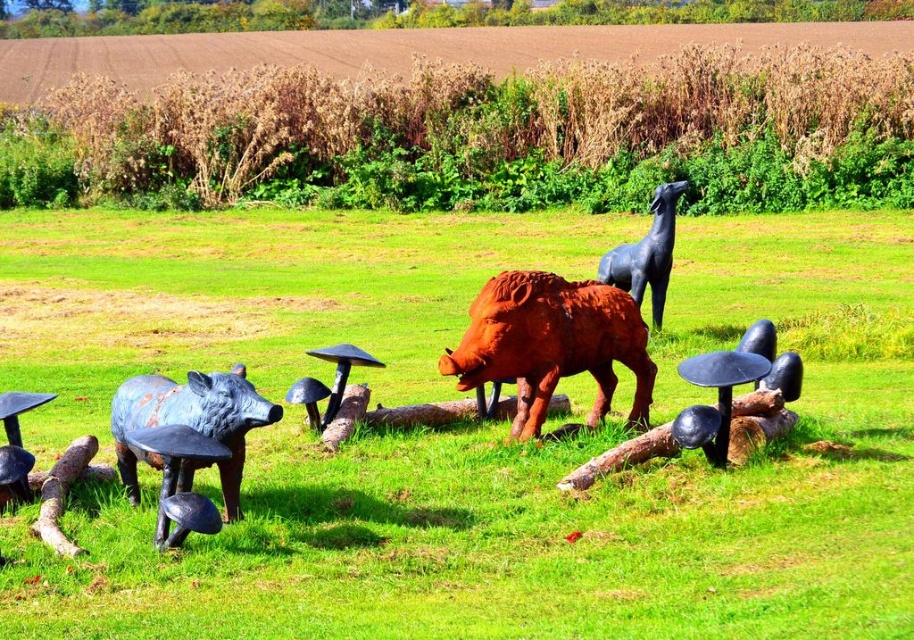
Who is taller, brown wood log at center or brushed metal boar at lower left?

brushed metal boar at lower left

In the scene shown: Is brown wood log at center shorter than brushed metal boar at lower left?

Correct, brown wood log at center is not as tall as brushed metal boar at lower left.

Is point (422, 410) farther from viewer compared to point (28, 456)?

Yes, it is.

At what (x,y) coordinates should I click in order to perform the action: click on brown wood log at center. Please return your answer as a coordinate pair (x, y). The image size is (914, 640). Looking at the image, I should click on (422, 413).

Can you confirm if rusty wood log at lower left is wider than brushed metal boar at lower left?

Correct, the width of rusty wood log at lower left exceeds that of brushed metal boar at lower left.

Can you confirm if rusty wood log at lower left is positioned below brushed metal boar at lower left?

Indeed, rusty wood log at lower left is positioned under brushed metal boar at lower left.

Between point (58, 532) and point (5, 397), which one is positioned in front?

Point (58, 532) is more forward.

In order to click on rusty wood log at lower left in this screenshot , I will do `click(62, 493)`.

Is rustic wood animal sculptures at center bigger than rusty wood log at lower left?

Correct, rustic wood animal sculptures at center is larger in size than rusty wood log at lower left.

Which is more to the right, rustic wood animal sculptures at center or rusty wood log at lower left?

rustic wood animal sculptures at center is more to the right.

What are the coordinates of `rustic wood animal sculptures at center` in the screenshot? It's located at (509, 538).

This screenshot has width=914, height=640. Find the location of `rustic wood animal sculptures at center`. rustic wood animal sculptures at center is located at coordinates (509, 538).